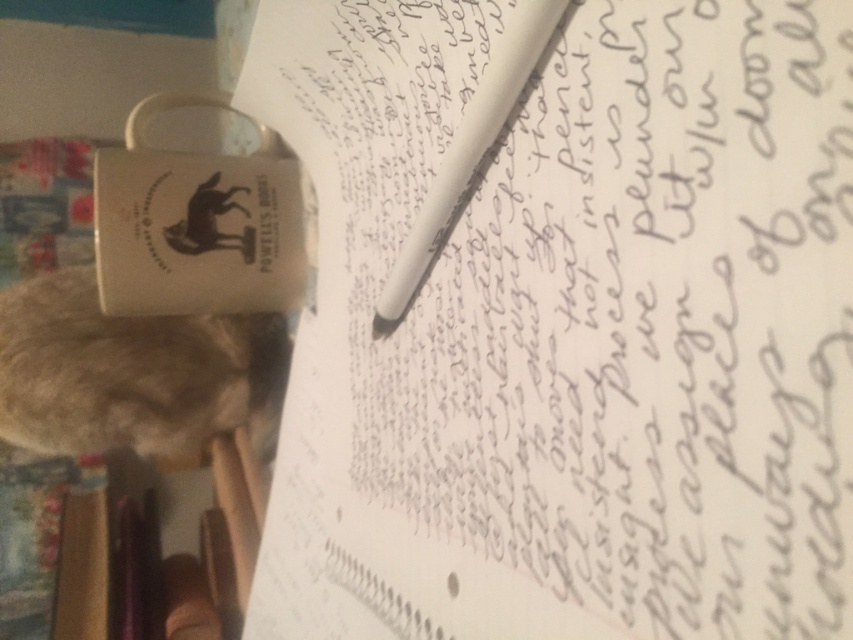
Can you confirm if fuzzy fur cat at lower left is positioned below white matte pen at center?

Yes.

Is fuzzy fur cat at lower left above white matte pen at center?

No.

The width and height of the screenshot is (853, 640). What do you see at coordinates (132, 372) in the screenshot? I see `fuzzy fur cat at lower left` at bounding box center [132, 372].

The height and width of the screenshot is (640, 853). I want to click on fuzzy fur cat at lower left, so click(x=132, y=372).

Between white paper at center and fuzzy fur cat at lower left, which one appears on the left side from the viewer's perspective?

fuzzy fur cat at lower left is more to the left.

Is point (426, 486) positioned in front of point (251, 342)?

Yes, it is in front of point (251, 342).

This screenshot has height=640, width=853. I want to click on white paper at center, so click(x=569, y=328).

Is white paper at center to the right of white matte pen at center from the viewer's perspective?

Incorrect, white paper at center is not on the right side of white matte pen at center.

Who is lower down, white paper at center or white matte pen at center?

white paper at center

Describe the element at coordinates (569, 328) in the screenshot. I see `white paper at center` at that location.

Identify the location of white paper at center. (569, 328).